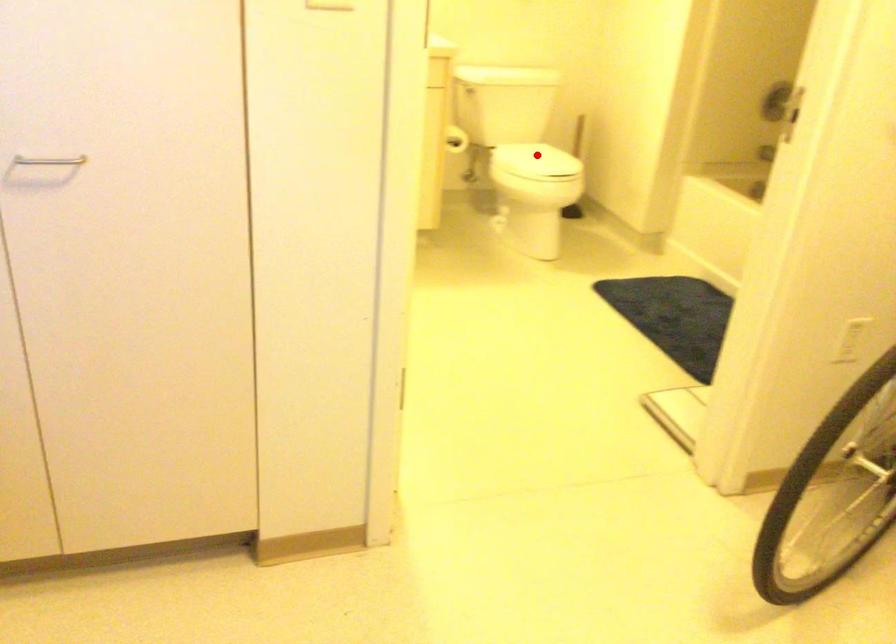
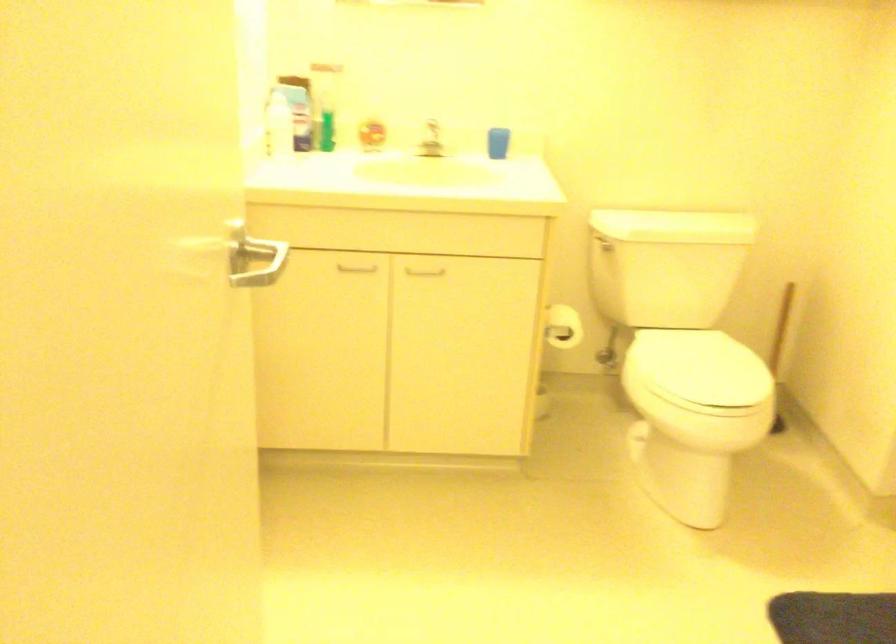
Locate, in the second image, the point that corresponds to the highlighted location in the first image.

(696, 368)